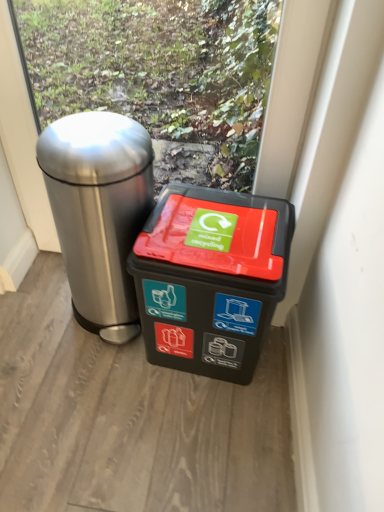
Identify the location of vacant space that is to the left of black plastic recycling bin at center, the 2th waste container viewed from the left. The width and height of the screenshot is (384, 512). (87, 373).